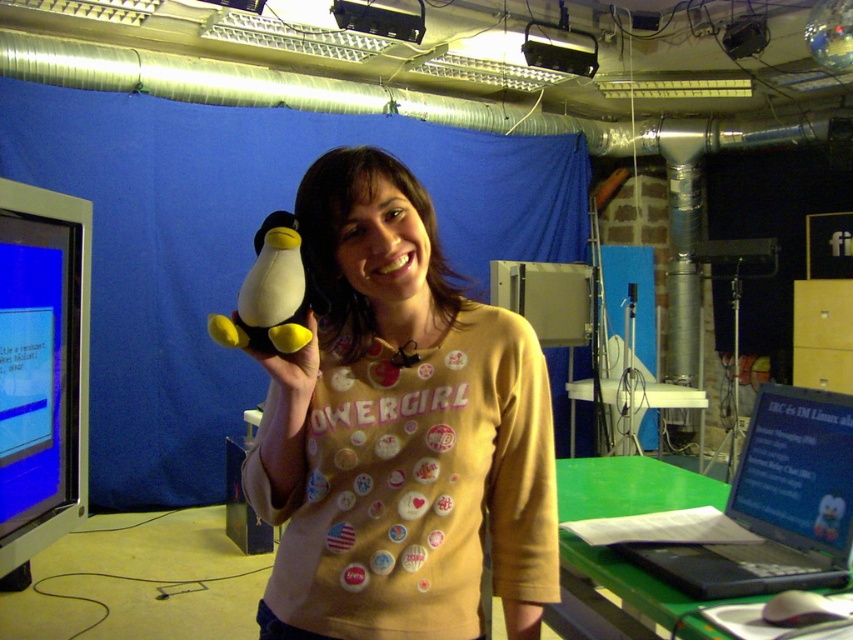
Who is shorter, blue fabric backdrop at upper left or white plush toy at center?

white plush toy at center

Who is taller, blue fabric backdrop at upper left or white plush toy at center?

With more height is blue fabric backdrop at upper left.

Is point (515, 250) farther from viewer compared to point (242, 285)?

Yes, point (515, 250) is behind point (242, 285).

Find the location of a particular element. The image size is (853, 640). blue fabric backdrop at upper left is located at coordinates (239, 248).

Can you confirm if blue fabric backdrop at upper left is smaller than black plastic laptop at lower right?

Incorrect, blue fabric backdrop at upper left is not smaller in size than black plastic laptop at lower right.

Measure the distance between point (117,502) and camera.

Point (117,502) is 13.39 feet from camera.

I want to click on blue fabric backdrop at upper left, so pos(239,248).

The image size is (853, 640). Identify the location of blue fabric backdrop at upper left. coord(239,248).

Between black plastic laptop at lower right and white plush toy at center, which one is positioned higher?

white plush toy at center is above.

Locate an element on the screen. black plastic laptop at lower right is located at coordinates (775, 504).

Measure the distance between point (770, 392) and camera.

A distance of 5.29 feet exists between point (770, 392) and camera.

Locate an element on the screen. The width and height of the screenshot is (853, 640). black plastic laptop at lower right is located at coordinates (775, 504).